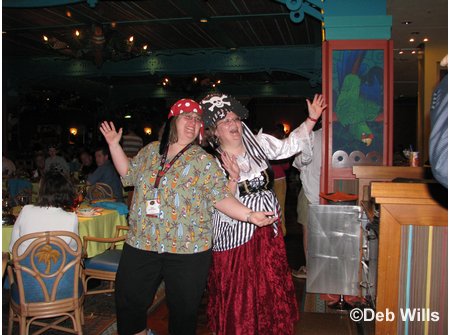
Locate an element on the screen. This screenshot has width=450, height=335. rattan chair is located at coordinates (15, 257), (52, 306), (93, 240), (106, 273).